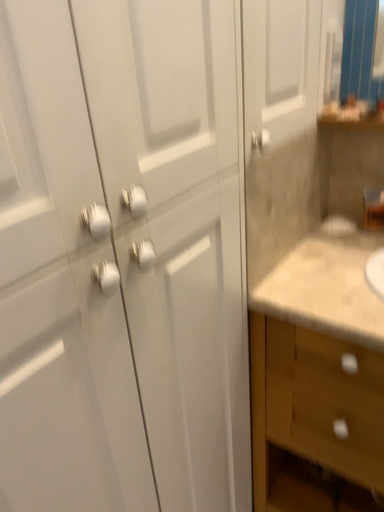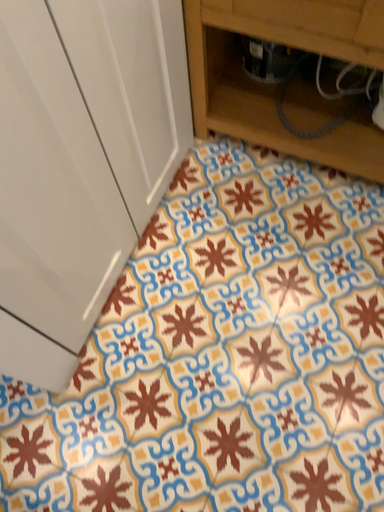
Question: Which way did the camera rotate in the video?

Choices:
 (A) rotated upward
 (B) rotated downward

Answer: (B)